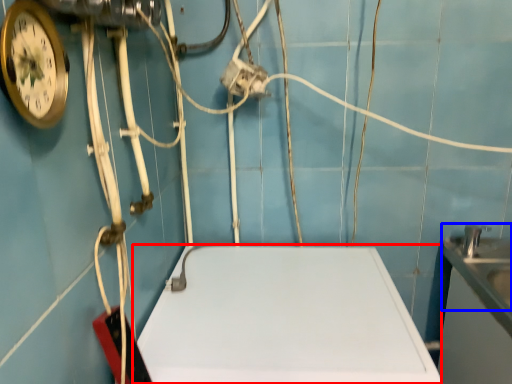
Question: Which of the following is the farthest to the observer, counter top (highlighted by a red box) or sink (highlighted by a blue box)?

Choices:
 (A) counter top
 (B) sink

Answer: (B)